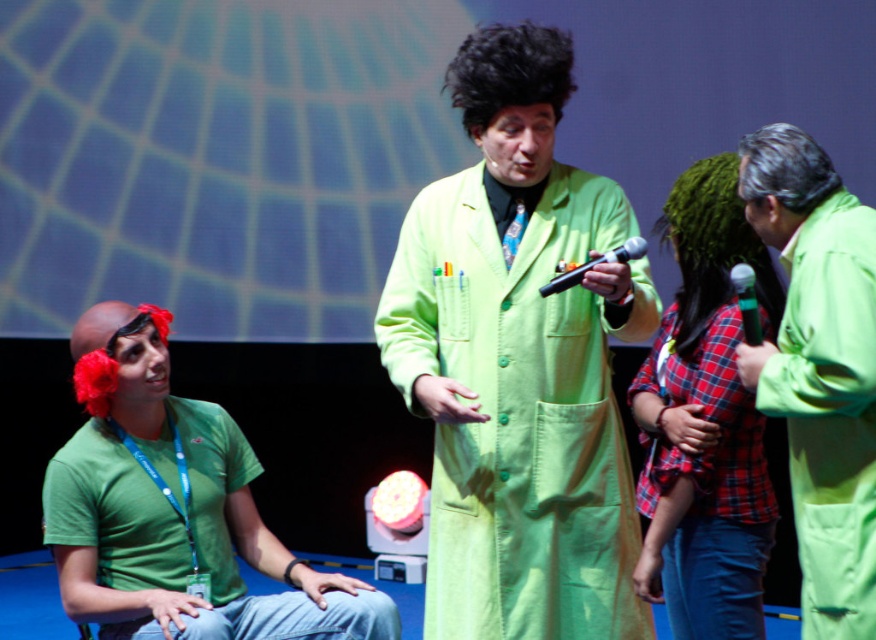
You are standing in the performance area and want to move to the point marked at coordinates point [866,548]. If you can walk 3 feet per second, how many seconds will it take you to reach that point?

The distance between you and point [866,548] is 7.92 feet. At a walking speed of 3 feet per second, it would take approximately 2.64 seconds to reach the point.